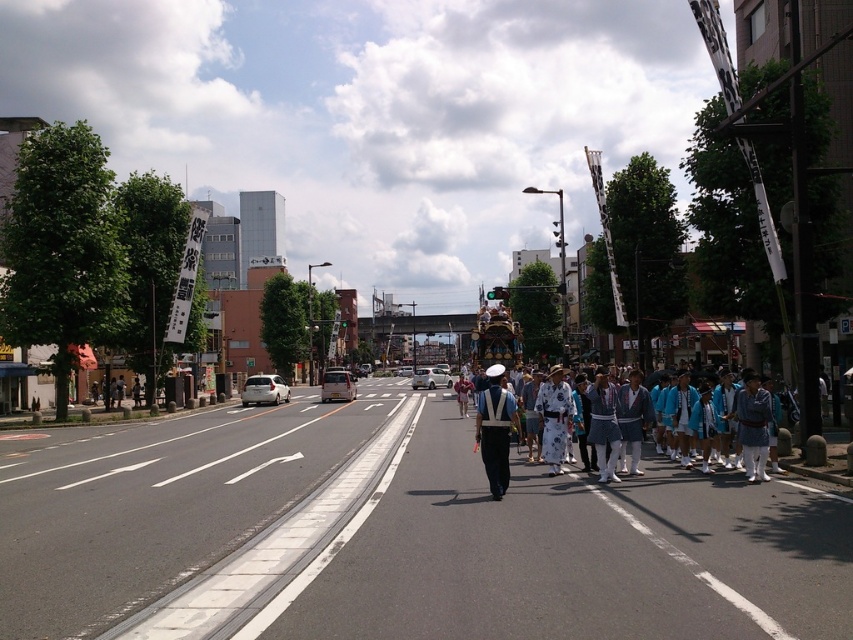
Who is higher up, white uniform at center or matte black uniform at center?

Positioned higher is matte black uniform at center.

Between white uniform at center and matte black uniform at center, which one appears on the right side from the viewer's perspective?

white uniform at center

Locate an element on the screen. white uniform at center is located at coordinates (605, 424).